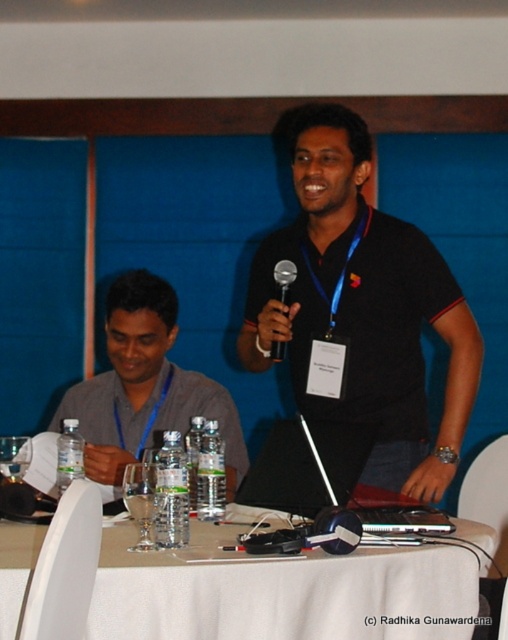
Question: Can you confirm if black matte shirt at center is positioned to the right of silver metallic microphone at center?

Choices:
 (A) yes
 (B) no

Answer: (A)

Question: Is black matte shirt at center closer to the viewer compared to gray fabric shirt at left?

Choices:
 (A) no
 (B) yes

Answer: (B)

Question: Which object is closer to the camera taking this photo?

Choices:
 (A) silver metallic microphone at center
 (B) black matte shirt at center
 (C) white cloth table at center

Answer: (C)

Question: Based on their relative distances, which object is nearer to the gray fabric shirt at left?

Choices:
 (A) silver metallic microphone at center
 (B) black matte shirt at center
 (C) white cloth table at center

Answer: (B)

Question: Which point appears farthest from the camera in this image?

Choices:
 (A) (181, 636)
 (B) (202, 385)
 (C) (288, 278)

Answer: (B)

Question: Is gray fabric shirt at left wider than silver metallic microphone at center?

Choices:
 (A) yes
 (B) no

Answer: (A)